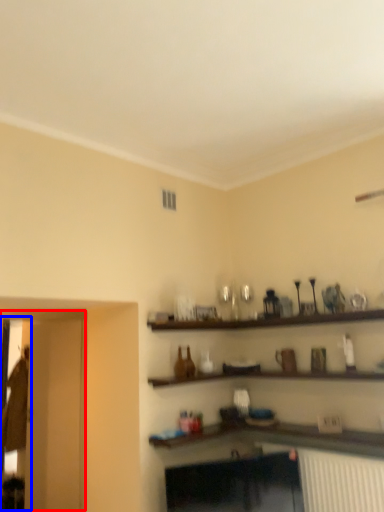
Question: Which point is closer to the camera, glass door (highlighted by a red box) or glass door (highlighted by a blue box)?

Choices:
 (A) glass door
 (B) glass door

Answer: (A)